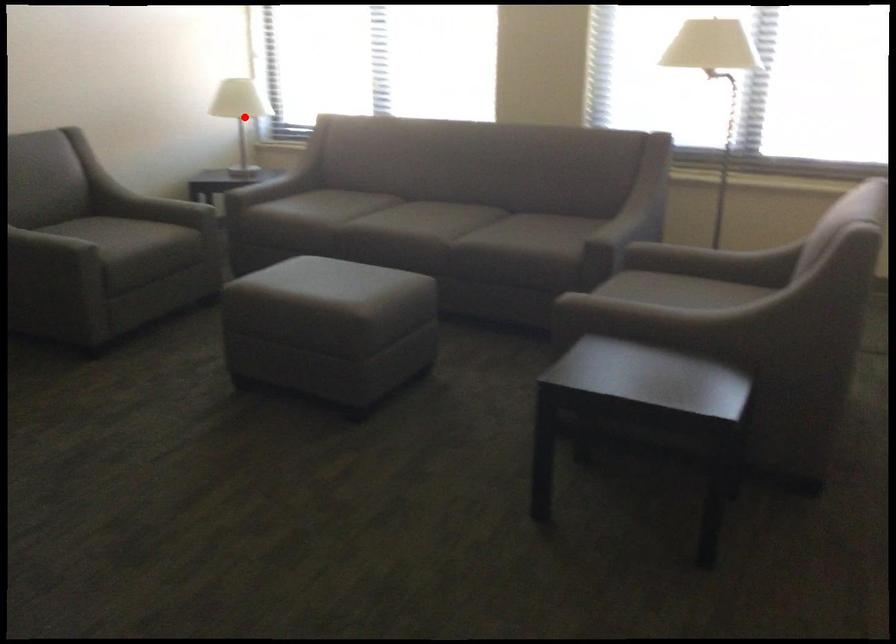
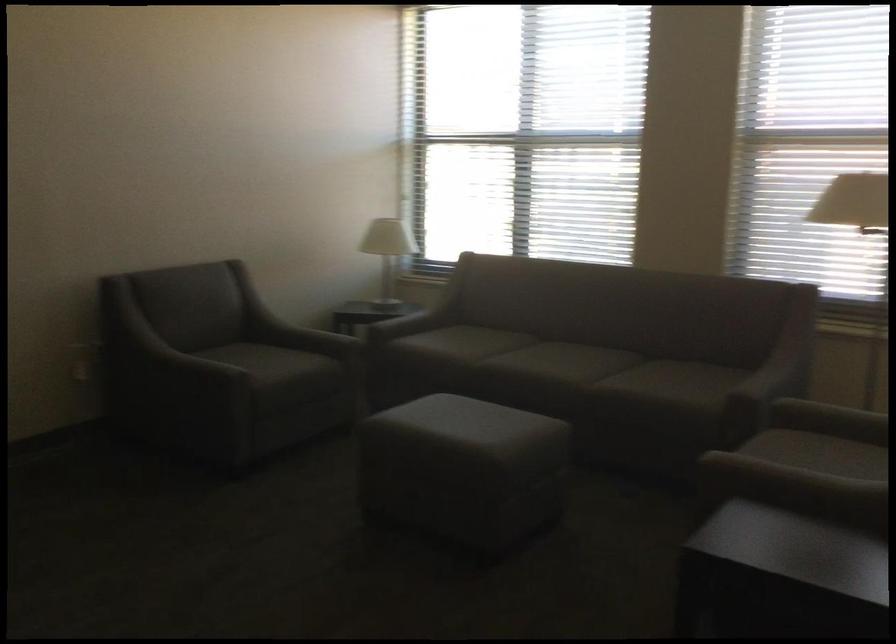
Where in the second image is the point corresponding to the highlighted location from the first image?

(386, 252)